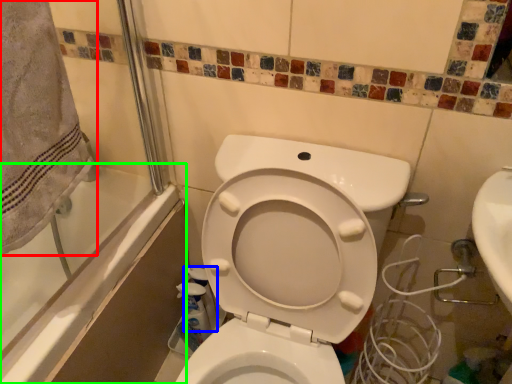
Question: Estimate the real-world distances between objects in this image. Which object is farther from bath towel (highlighted by a red box), cleaning product (highlighted by a blue box) or bath (highlighted by a green box)?

Choices:
 (A) cleaning product
 (B) bath

Answer: (A)